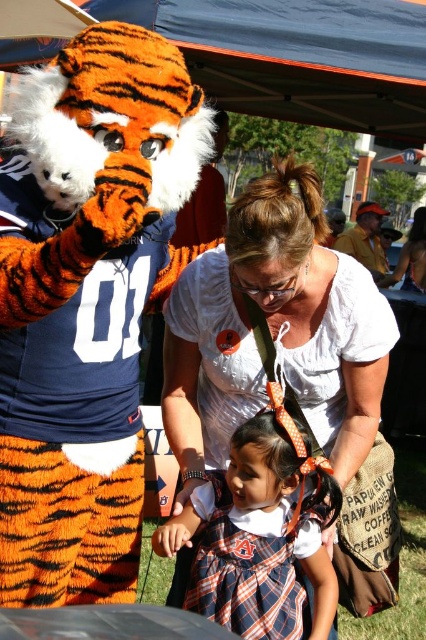
You are organizing a photo shoot and need to ensure that the white cotton shirt at center and the plaid fabric dress at center fit within a 1.5 meter wide backdrop. Given their widths, will both items fit side by side without overlapping?

The white cotton shirt at center is wider than the plaid fabric dress at center. However, since the total width of both items combined would exceed 1.5 meters, they cannot fit side by side without overlapping on the backdrop.

You are a photographer at the event and need to capture a photo of both the white cotton shirt at center and the plaid fabric dress at center. Which one should you focus on first to ensure both are in frame?

The white cotton shirt at center is much taller than the plaid fabric dress at center, so you should focus on the white cotton shirt at center first to ensure both are in frame.

You are a photographer at the event and want to capture a photo of both the white cotton shirt at center and the plaid fabric dress at center in the same frame. Given that your camera has a focal length of 50mm and a sensor size of 24mm x 36mm, what is the minimum distance you need to stand from the subjects to ensure both are fully in frame?

The minimum distance required is approximately 26.90 centimeters. Since the distance between the white cotton shirt at center and the plaid fabric dress at center is 26.90 centimeters, positioning yourself at this distance ensures both subjects fit within the camera frame.